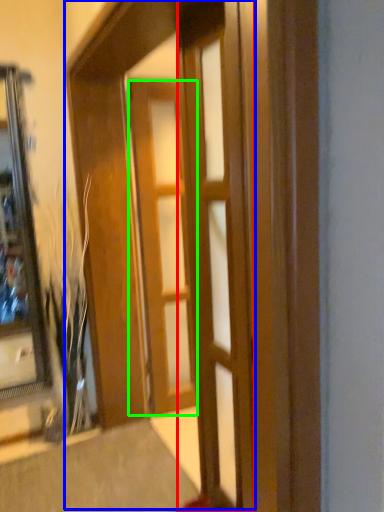
Question: Which is farther away from door (highlighted by a red box)? barn door (highlighted by a blue box) or door (highlighted by a green box)?

Choices:
 (A) barn door
 (B) door

Answer: (B)